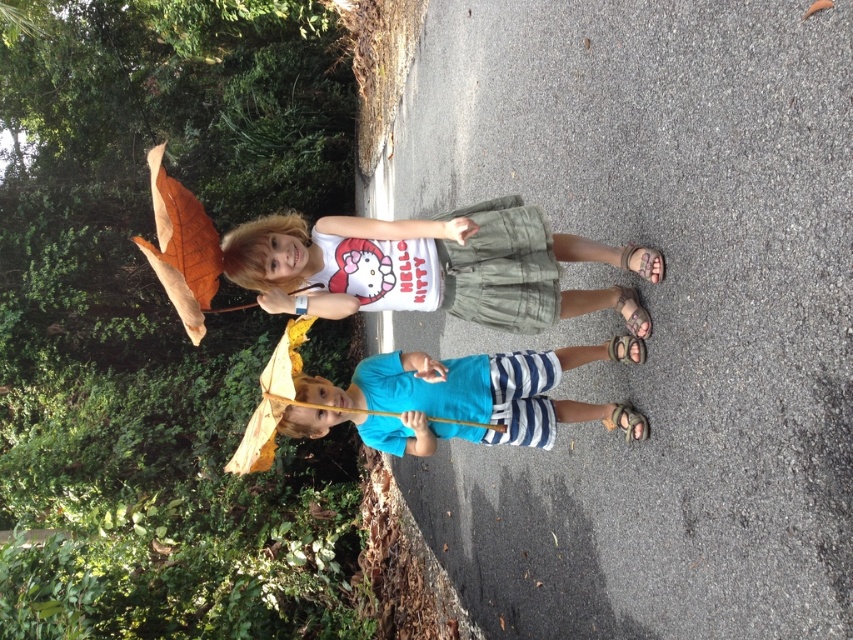
Question: Where is white cotton shirt at center located in relation to blue striped shorts at center in the image?

Choices:
 (A) right
 (B) left

Answer: (B)

Question: Which of the following is the closest to the observer?

Choices:
 (A) white cotton shirt at center
 (B) blue striped shorts at center

Answer: (A)

Question: Among these objects, which one is nearest to the camera?

Choices:
 (A) blue striped shorts at center
 (B) white cotton shirt at center

Answer: (B)

Question: Among these points, which one is nearest to the camera?

Choices:
 (A) (587, 260)
 (B) (344, 413)

Answer: (B)

Question: Does white cotton shirt at center have a larger size compared to blue striped shorts at center?

Choices:
 (A) no
 (B) yes

Answer: (B)

Question: Can you confirm if white cotton shirt at center is thinner than blue striped shorts at center?

Choices:
 (A) no
 (B) yes

Answer: (A)